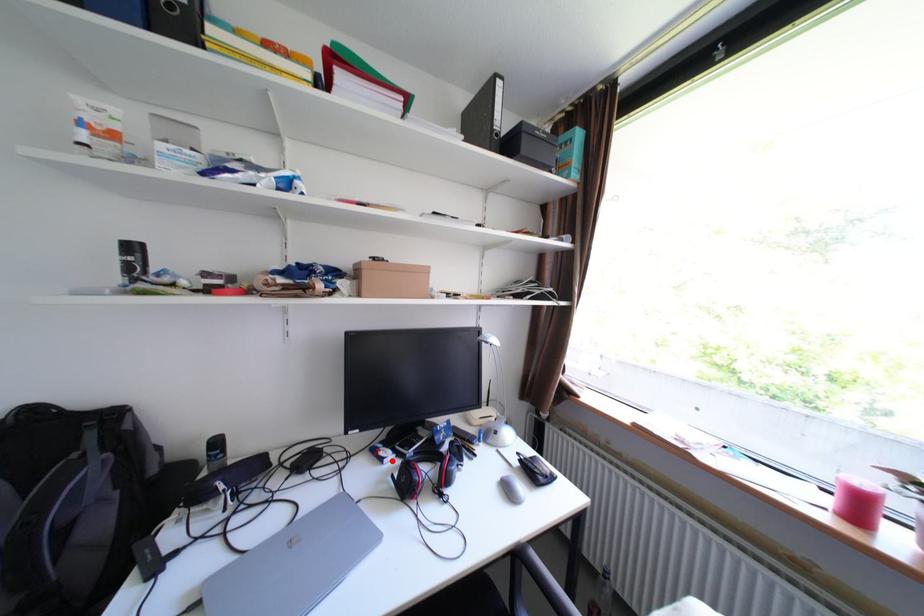
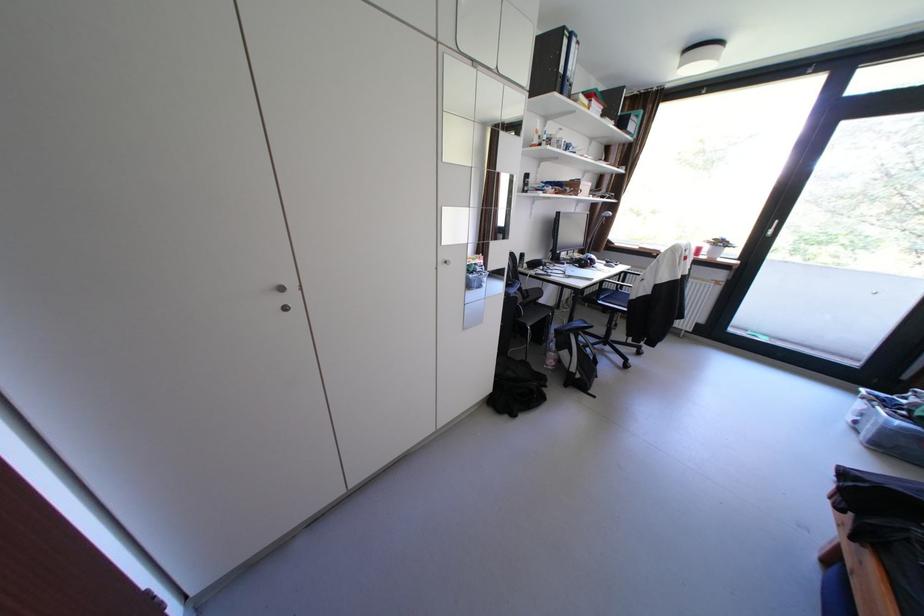
In the second image, find the point that corresponds to the highlighted location in the first image.

(574, 264)